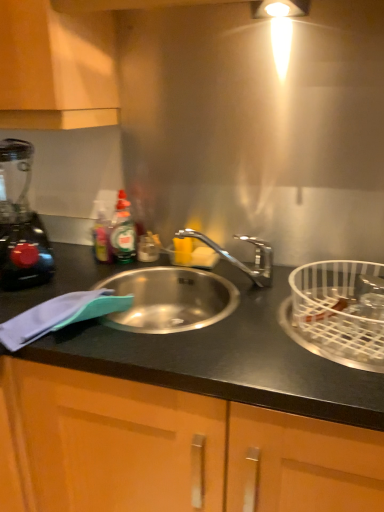
Locate an element on the screen. The image size is (384, 512). black matte countertop at left is located at coordinates (226, 360).

At what (x,y) coordinates should I click in order to perform the action: click on matte wood cabinet at upper left. Please return your answer as a coordinate pair (x, y). This screenshot has height=512, width=384. Looking at the image, I should click on (56, 68).

The height and width of the screenshot is (512, 384). What do you see at coordinates (56, 68) in the screenshot?
I see `matte wood cabinet at upper left` at bounding box center [56, 68].

This screenshot has height=512, width=384. Identify the location of black plastic blender at left. (20, 222).

Can you confirm if black matte countertop at left is taller than black plastic blender at left?

Correct, black matte countertop at left is much taller as black plastic blender at left.

Considering the relative sizes of black matte countertop at left and black plastic blender at left in the image provided, is black matte countertop at left bigger than black plastic blender at left?

Correct, black matte countertop at left is larger in size than black plastic blender at left.

You are a GUI agent. You are given a task and a screenshot of the screen. Output one action in this format:
    pyautogui.click(x=<x>, y=<y>)
    Task: Click on the blender located above the black matte countertop at left (from the image's perspective)
    The height and width of the screenshot is (512, 384).
    Given the screenshot: What is the action you would take?
    pyautogui.click(x=20, y=222)

Considering the relative positions of black matte countertop at left and black plastic blender at left in the image provided, is black matte countertop at left to the left of black plastic blender at left from the viewer's perspective?

No.

Does matte wood cabinet at upper left turn towards white wire basket at right?

No, matte wood cabinet at upper left is not turned towards white wire basket at right.

From a real-world perspective, is matte wood cabinet at upper left on white wire basket at right?

Yes, from a real-world perspective, matte wood cabinet at upper left is over white wire basket at right

Between point (73, 61) and point (327, 303), which one is positioned in front?

Point (327, 303)

Which of these two, matte wood cabinet at upper left or white wire basket at right, is wider?

With larger width is white wire basket at right.

From a real-world perspective, is black matte countertop at left physically below white wire basket at right?

Yes, from a real-world perspective, black matte countertop at left is under white wire basket at right.

Is black matte countertop at left taller or shorter than white wire basket at right?

Considering their sizes, black matte countertop at left has more height than white wire basket at right.

Is black matte countertop at left facing away from white wire basket at right?

No.

Can you confirm if black matte countertop at left is smaller than white wire basket at right?

No.

Considering the relative positions of black matte countertop at left and matte wood cabinet at upper left in the image provided, is black matte countertop at left in front of matte wood cabinet at upper left?

Yes, black matte countertop at left is in front of matte wood cabinet at upper left.

From a real-world perspective, is black matte countertop at left below matte wood cabinet at upper left?

Yes, from a real-world perspective, black matte countertop at left is beneath matte wood cabinet at upper left.

Based on their sizes in the image, would you say black matte countertop at left is bigger or smaller than matte wood cabinet at upper left?

In the image, black matte countertop at left appears to be larger than matte wood cabinet at upper left.

Find the location of `cabinetry that is above the black matte countertop at left (from the image's perspective)`. cabinetry that is above the black matte countertop at left (from the image's perspective) is located at coordinates (56, 68).

Is point (322, 327) positioned after point (27, 186)?

No.

You are a GUI agent. You are given a task and a screenshot of the screen. Output one action in this format:
    pyautogui.click(x=<x>, y=<y>)
    Task: Click on the basket in front of the black plastic blender at left
    
    Given the screenshot: What is the action you would take?
    pyautogui.click(x=341, y=311)

What's the angular difference between white wire basket at right and black plastic blender at left's facing directions?

They differ by 51.4 degrees in their facing directions.

From the image's perspective, is white wire basket at right under black plastic blender at left?

Yes.

From the image's perspective, which one is positioned higher, matte wood cabinet at upper left or black plastic blender at left?

From the image's view, matte wood cabinet at upper left is above.

Consider the image. Would you say matte wood cabinet at upper left is inside or outside black plastic blender at left?

matte wood cabinet at upper left is located beyond the bounds of black plastic blender at left.

How different are the orientations of matte wood cabinet at upper left and black plastic blender at left in degrees?

The angle between the facing direction of matte wood cabinet at upper left and the facing direction of black plastic blender at left is 53 degrees.

Would you say matte wood cabinet at upper left is a long distance from black plastic blender at left?

matte wood cabinet at upper left is near black plastic blender at left, not far away.

Considering the sizes of objects black plastic blender at left and black matte countertop at left in the image provided, who is thinner, black plastic blender at left or black matte countertop at left?

Thinner between the two is black plastic blender at left.

Is black plastic blender at left to the left or to the right of black matte countertop at left in the image?

black plastic blender at left is to the left of black matte countertop at left.

Is black plastic blender at left facing towards black matte countertop at left?

No, black plastic blender at left is not aimed at black matte countertop at left.

Consider the image. Considering the sizes of black plastic blender at left and black matte countertop at left in the image, is black plastic blender at left taller or shorter than black matte countertop at left?

Clearly, black plastic blender at left is shorter compared to black matte countertop at left.

Locate an element on the screen. The height and width of the screenshot is (512, 384). countertop on the right side of black plastic blender at left is located at coordinates (226, 360).

In order to click on cabinetry above the white wire basket at right (from a real-world perspective) in this screenshot , I will do `click(56, 68)`.

When comparing their distances from white wire basket at right, does matte wood cabinet at upper left or black plastic blender at left seem closer?

Based on the image, black plastic blender at left appears to be nearer to white wire basket at right.

When comparing their distances from black plastic blender at left, does black matte countertop at left or white wire basket at right seem further?

white wire basket at right is positioned further to the anchor black plastic blender at left.

In the scene shown: Estimate the real-world distances between objects in this image. Which object is closer to matte wood cabinet at upper left, white wire basket at right or black plastic blender at left?

black plastic blender at left.

From the image, which object appears to be farther from matte wood cabinet at upper left, black plastic blender at left or black matte countertop at left?

black matte countertop at left is further to matte wood cabinet at upper left.

From the image, which object appears to be nearer to black plastic blender at left, black matte countertop at left or matte wood cabinet at upper left?

matte wood cabinet at upper left lies closer to black plastic blender at left than the other object.

When comparing their distances from black matte countertop at left, does matte wood cabinet at upper left or black plastic blender at left seem closer?

Among the two, black plastic blender at left is located nearer to black matte countertop at left.

Considering their positions, is black plastic blender at left positioned further to black matte countertop at left than white wire basket at right?

black plastic blender at left is further to black matte countertop at left.

Considering their positions, is black matte countertop at left positioned closer to matte wood cabinet at upper left than black plastic blender at left?

black plastic blender at left lies closer to matte wood cabinet at upper left than the other object.

You are a GUI agent. You are given a task and a screenshot of the screen. Output one action in this format:
    pyautogui.click(x=<x>, y=<y>)
    Task: Click on the blender that lies between matte wood cabinet at upper left and black matte countertop at left from top to bottom
    
    Given the screenshot: What is the action you would take?
    pyautogui.click(x=20, y=222)

You are a GUI agent. You are given a task and a screenshot of the screen. Output one action in this format:
    pyautogui.click(x=<x>, y=<y>)
    Task: Click on the basket that lies between matte wood cabinet at upper left and black matte countertop at left from top to bottom
    This screenshot has width=384, height=512.
    Given the screenshot: What is the action you would take?
    pyautogui.click(x=341, y=311)

Identify the location of countertop situated between black plastic blender at left and white wire basket at right from left to right. (226, 360).

The width and height of the screenshot is (384, 512). I want to click on cabinetry located between black plastic blender at left and white wire basket at right in the left-right direction, so click(56, 68).